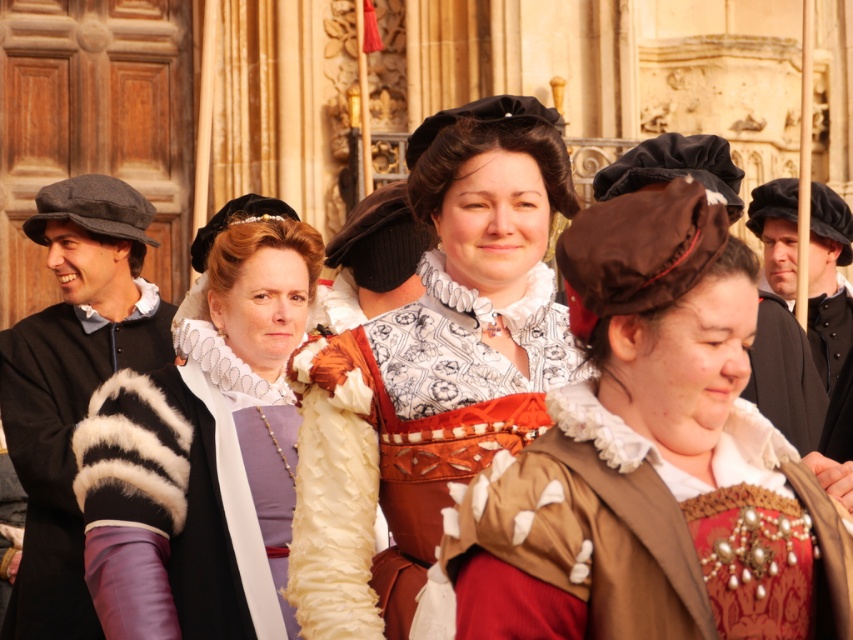
Question: Estimate the real-world distances between objects in this image. Which object is farther from the white fur coat at center?

Choices:
 (A) black woolen hat at left
 (B) brown felt hat at center

Answer: (B)

Question: Considering the real-world distances, which object is closest to the brown felt hat at center?

Choices:
 (A) velvet brown dress at center
 (B) matte white ruffled collar at center
 (C) black woolen hat at left
 (D) white fur coat at center

Answer: (B)

Question: Among these objects, which one is farthest from the camera?

Choices:
 (A) matte white ruffled collar at center
 (B) white fur coat at center
 (C) black woolen hat at left
 (D) brown felt hat at center

Answer: (D)

Question: Can you confirm if matte white ruffled collar at center is positioned to the right of black woolen hat at left?

Choices:
 (A) no
 (B) yes

Answer: (B)

Question: Can you confirm if matte white ruffled collar at center is positioned to the right of black woolen hat at left?

Choices:
 (A) yes
 (B) no

Answer: (A)

Question: Can you confirm if black woolen hat at left is wider than brown felt hat at center?

Choices:
 (A) yes
 (B) no

Answer: (B)